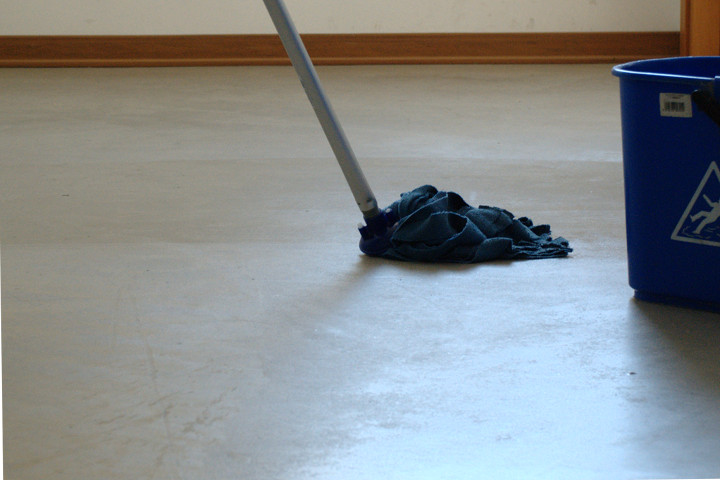
The width and height of the screenshot is (720, 480). In order to click on dry floor in this screenshot , I will do `click(348, 404)`.